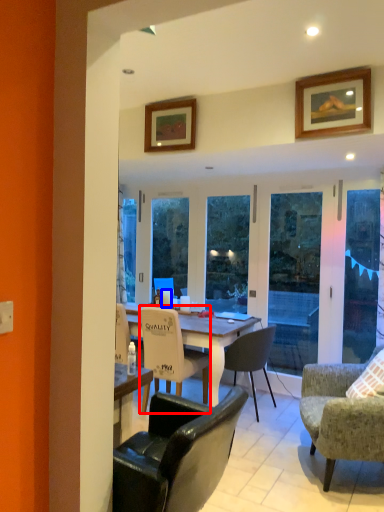
Question: Which of the following is the closest to the observer, chair (highlighted by a red box) or coffee cup (highlighted by a blue box)?

Choices:
 (A) chair
 (B) coffee cup

Answer: (A)